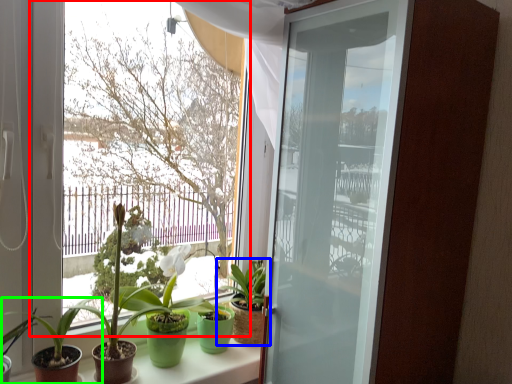
Question: Estimate the real-world distances between objects in this image. Which object is farther from window (highlighted by a red box), houseplant (highlighted by a blue box) or houseplant (highlighted by a green box)?

Choices:
 (A) houseplant
 (B) houseplant

Answer: (B)